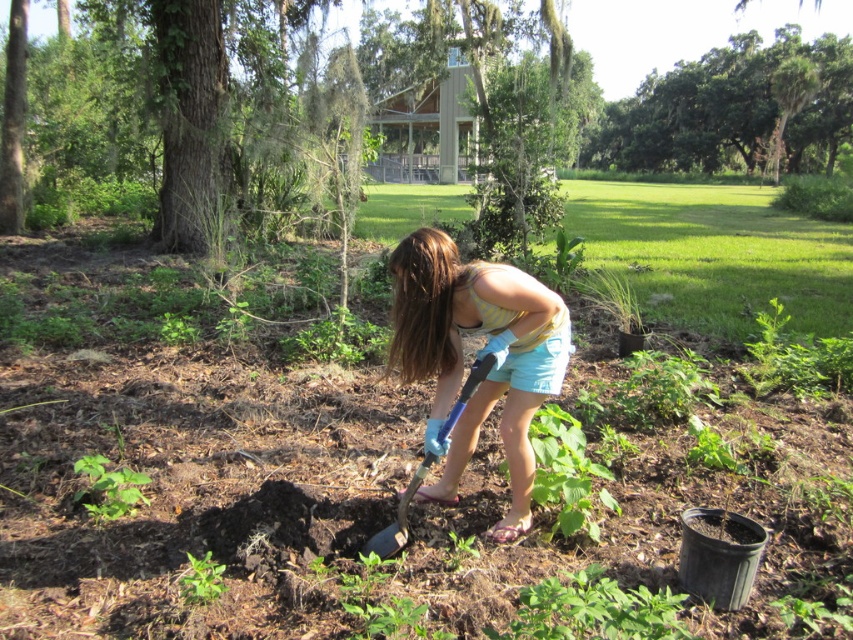
You are a gardener who needs to decide which tool to use for digging. You see the green leafy tree at upper center and the blue plastic shovel at center. Which object is more suitable for digging?

The blue plastic shovel at center is more suitable for digging, as the green leafy tree at upper center is just a tree and not a tool.